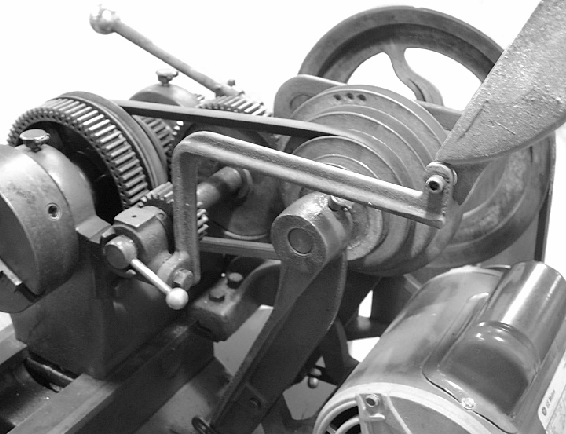
The width and height of the screenshot is (566, 434). I want to click on screws, so click(x=370, y=405), click(x=428, y=185).